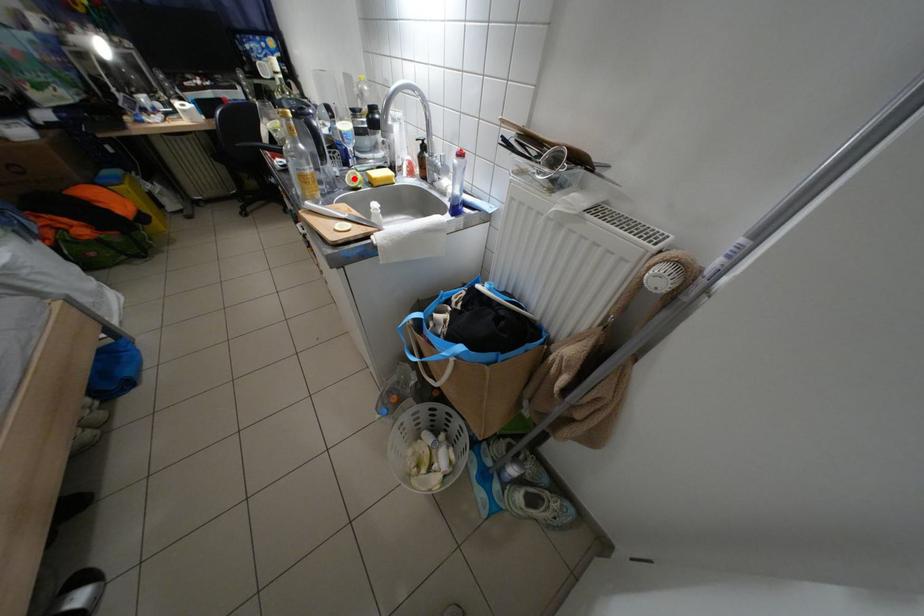
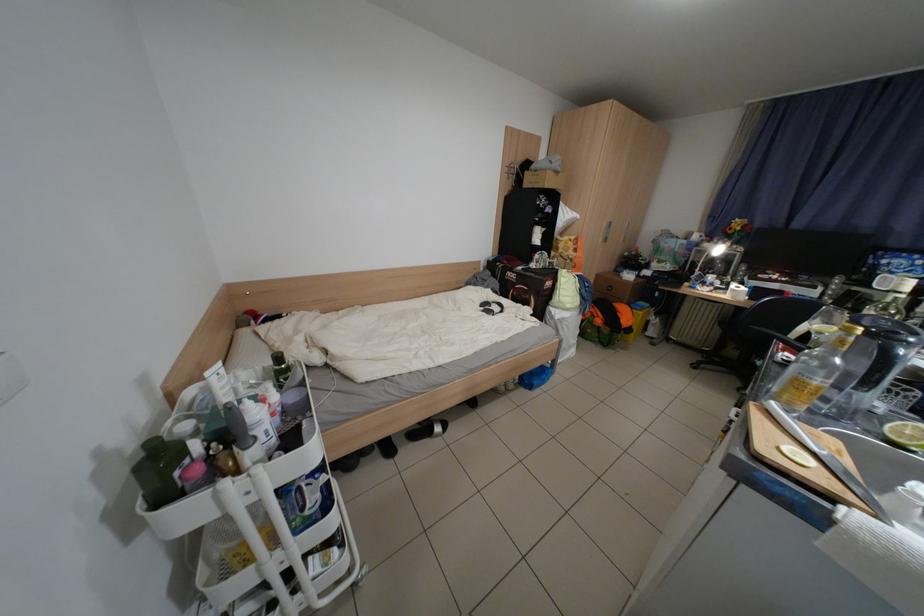
Find the pixel in the second image that matches the highlighted location in the first image.

(896, 421)